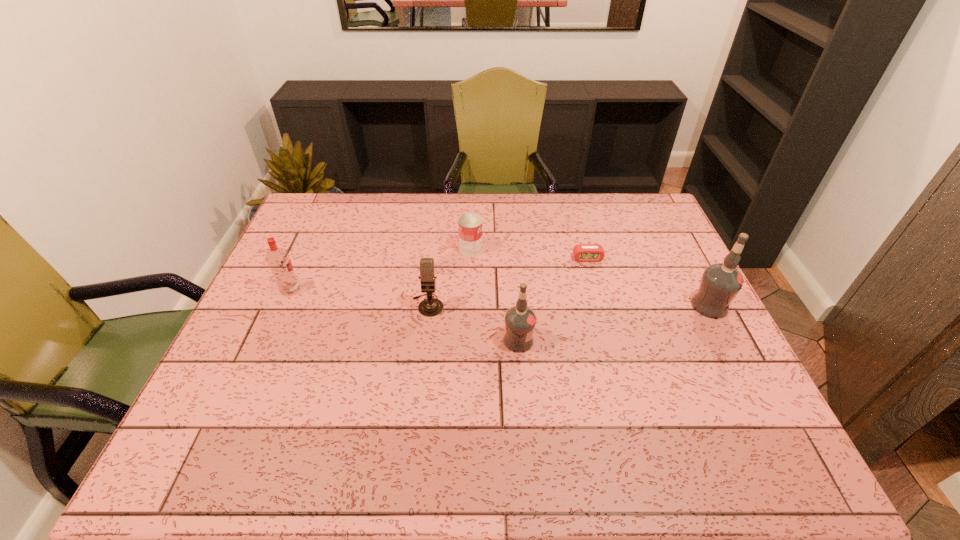
The width and height of the screenshot is (960, 540). I want to click on the third object from right to left, so click(520, 320).

You are a GUI agent. You are given a task and a screenshot of the screen. Output one action in this format:
    pyautogui.click(x=<x>, y=<y>)
    Task: Click on the nearest vodka
    This screenshot has height=540, width=960.
    Given the screenshot: What is the action you would take?
    pyautogui.click(x=520, y=320)

At what (x,y) coordinates should I click in order to perform the action: click on the rightmost vodka. Please return your answer as a coordinate pair (x, y). Looking at the image, I should click on (720, 283).

Locate an element on the screen. The width and height of the screenshot is (960, 540). the tallest vodka is located at coordinates (720, 283).

This screenshot has width=960, height=540. Identify the location of alarm clock. (582, 252).

Find the location of `the shortest object`. the shortest object is located at coordinates (582, 252).

The width and height of the screenshot is (960, 540). In order to click on the third object from left to right in this screenshot , I will do `click(469, 225)`.

Image resolution: width=960 pixels, height=540 pixels. Find the location of `can`. can is located at coordinates (469, 225).

The height and width of the screenshot is (540, 960). In order to click on microphone in this screenshot , I will do `click(429, 307)`.

Where is `the leftmost object`? The image size is (960, 540). the leftmost object is located at coordinates (278, 259).